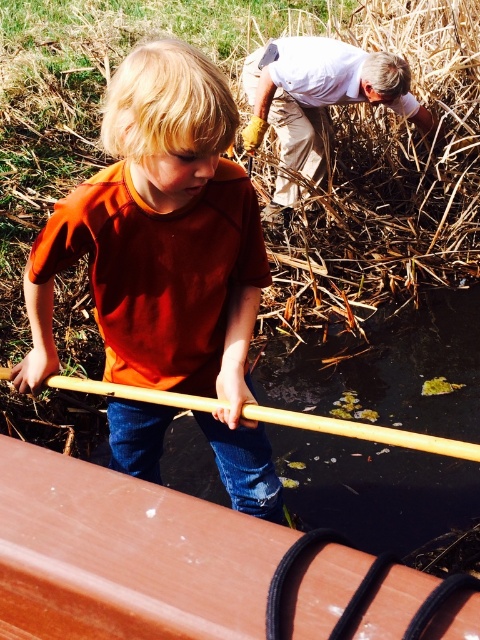
Question: Can you confirm if brown straw at upper center is thinner than brown wood canoe at lower left?

Choices:
 (A) no
 (B) yes

Answer: (A)

Question: Which is nearer to the brown straw at upper center?

Choices:
 (A) brown wood canoe at lower left
 (B) orange matte shirt at center

Answer: (B)

Question: Is brown straw at upper center smaller than brown wood canoe at lower left?

Choices:
 (A) yes
 (B) no

Answer: (B)

Question: Which point is farther to the camera?

Choices:
 (A) (119, 81)
 (B) (271, 317)
 (C) (155, 525)

Answer: (B)

Question: Is orange matte shirt at center smaller than brown wood canoe at lower left?

Choices:
 (A) no
 (B) yes

Answer: (A)

Question: Which point is closer to the camera?

Choices:
 (A) (124, 472)
 (B) (255, 593)
 (C) (82, 106)

Answer: (B)